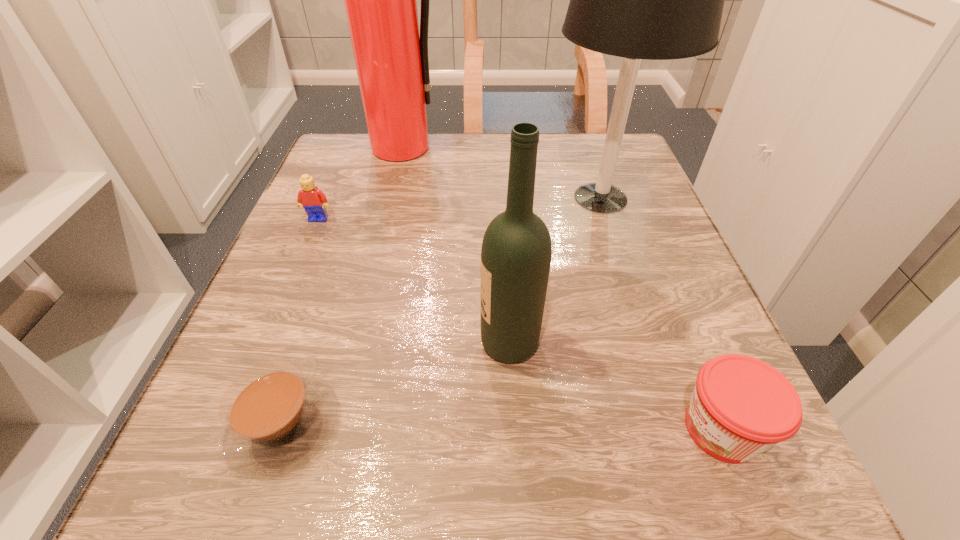
Identify the location of fire extinguisher. The height and width of the screenshot is (540, 960). (391, 58).

Identify the location of table lamp. This screenshot has width=960, height=540. (657, 0).

The image size is (960, 540). What are the coordinates of `wine bottle` in the screenshot? It's located at (516, 251).

The height and width of the screenshot is (540, 960). What are the coordinates of `the third nearest object` in the screenshot? It's located at (516, 251).

I want to click on Lego, so click(313, 200).

The width and height of the screenshot is (960, 540). Find the location of `jam`. jam is located at coordinates (741, 406).

Locate an element on the screen. This screenshot has width=960, height=540. the shortest object is located at coordinates (275, 419).

The image size is (960, 540). What are the coordinates of `vacant area located 0.400m at the nozzle of the fire extinguisher` in the screenshot? It's located at (367, 295).

The width and height of the screenshot is (960, 540). I want to click on vacant region located on the left of the table lamp, so click(518, 198).

Locate an element on the screen. vacant space located 0.150m on the labeled side of the third nearest object is located at coordinates (375, 343).